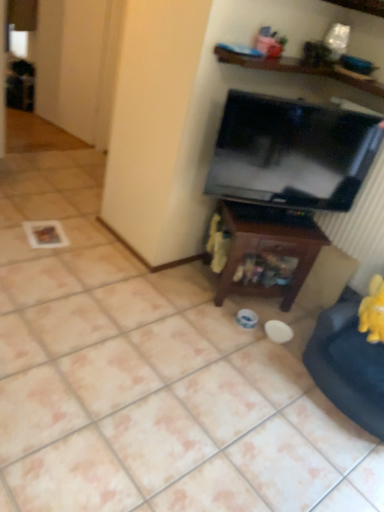
Question: Is velvet yellow swivel chair at lower right far away from black glossy tv at upper right?

Choices:
 (A) no
 (B) yes

Answer: (A)

Question: Considering the relative sizes of velvet yellow swivel chair at lower right and black glossy tv at upper right in the image provided, is velvet yellow swivel chair at lower right taller than black glossy tv at upper right?

Choices:
 (A) no
 (B) yes

Answer: (A)

Question: Would you say velvet yellow swivel chair at lower right contains black glossy tv at upper right?

Choices:
 (A) no
 (B) yes

Answer: (A)

Question: Is velvet yellow swivel chair at lower right not inside black glossy tv at upper right?

Choices:
 (A) no
 (B) yes

Answer: (B)

Question: Considering the relative sizes of velvet yellow swivel chair at lower right and black glossy tv at upper right in the image provided, is velvet yellow swivel chair at lower right wider than black glossy tv at upper right?

Choices:
 (A) yes
 (B) no

Answer: (A)

Question: Considering the positions of wooden at upper center and velvet yellow swivel chair at lower right in the image, is wooden at upper center bigger or smaller than velvet yellow swivel chair at lower right?

Choices:
 (A) small
 (B) big

Answer: (A)

Question: From a real-world perspective, is wooden at upper center physically located above or below velvet yellow swivel chair at lower right?

Choices:
 (A) above
 (B) below

Answer: (A)

Question: Based on their positions, is wooden at upper center located to the left or right of velvet yellow swivel chair at lower right?

Choices:
 (A) left
 (B) right

Answer: (A)

Question: Do you think wooden at upper center is within velvet yellow swivel chair at lower right, or outside of it?

Choices:
 (A) inside
 (B) outside

Answer: (B)

Question: Looking at their shapes, would you say velvet yellow swivel chair at lower right is wider or thinner than wooden at upper center?

Choices:
 (A) thin
 (B) wide

Answer: (A)

Question: Considering the positions of velvet yellow swivel chair at lower right and wooden at upper center in the image, is velvet yellow swivel chair at lower right bigger or smaller than wooden at upper center?

Choices:
 (A) big
 (B) small

Answer: (A)

Question: Considering the positions of velvet yellow swivel chair at lower right and wooden at upper center in the image, is velvet yellow swivel chair at lower right taller or shorter than wooden at upper center?

Choices:
 (A) short
 (B) tall

Answer: (B)

Question: From a real-world perspective, relative to wooden at upper center, is velvet yellow swivel chair at lower right vertically above or below?

Choices:
 (A) above
 (B) below

Answer: (B)

Question: Is velvet yellow swivel chair at lower right taller or shorter than black glossy tv at upper right?

Choices:
 (A) tall
 (B) short

Answer: (B)

Question: Considering the positions of point (347, 407) and point (360, 120), is point (347, 407) closer or farther from the camera than point (360, 120)?

Choices:
 (A) farther
 (B) closer

Answer: (B)